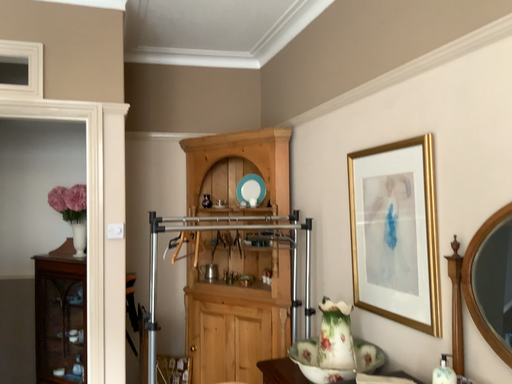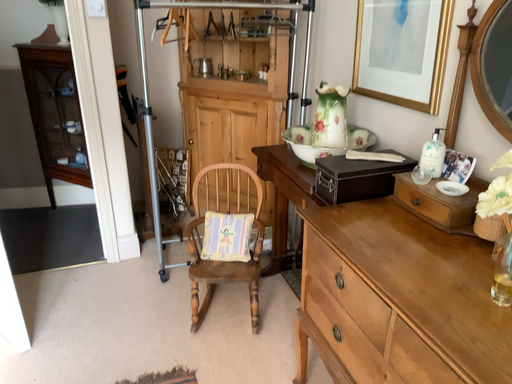
Question: Which way did the camera rotate in the video?

Choices:
 (A) rotated downward
 (B) rotated upward

Answer: (A)